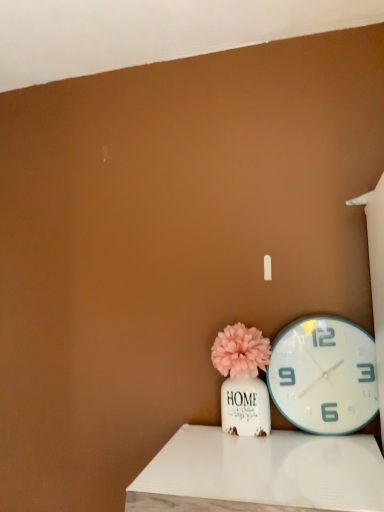
Question: Is white plastic wall clock at right with white wood table at lower center?

Choices:
 (A) yes
 (B) no

Answer: (B)

Question: Can you confirm if white plastic wall clock at right is positioned to the right of white wood table at lower center?

Choices:
 (A) no
 (B) yes

Answer: (B)

Question: Can you confirm if white plastic wall clock at right is thinner than white wood table at lower center?

Choices:
 (A) no
 (B) yes

Answer: (B)

Question: Does white plastic wall clock at right have a smaller size compared to white wood table at lower center?

Choices:
 (A) yes
 (B) no

Answer: (A)

Question: Is white plastic wall clock at right completely or partially outside of white wood table at lower center?

Choices:
 (A) yes
 (B) no

Answer: (A)

Question: Can you confirm if white plastic wall clock at right is bigger than white wood table at lower center?

Choices:
 (A) yes
 (B) no

Answer: (B)

Question: From a real-world perspective, is white wood table at lower center on top of matte pink pom-pom at center?

Choices:
 (A) yes
 (B) no

Answer: (B)

Question: Does white wood table at lower center have a lesser width compared to matte pink pom-pom at center?

Choices:
 (A) no
 (B) yes

Answer: (A)

Question: From the image's perspective, is white wood table at lower center located beneath matte pink pom-pom at center?

Choices:
 (A) yes
 (B) no

Answer: (A)

Question: Does white wood table at lower center have a greater width compared to matte pink pom-pom at center?

Choices:
 (A) no
 (B) yes

Answer: (B)

Question: Considering the relative sizes of white wood table at lower center and matte pink pom-pom at center in the image provided, is white wood table at lower center bigger than matte pink pom-pom at center?

Choices:
 (A) yes
 (B) no

Answer: (A)

Question: Is white wood table at lower center positioned in front of matte pink pom-pom at center?

Choices:
 (A) yes
 (B) no

Answer: (A)

Question: Are white wood table at lower center and white plastic wall clock at right making contact?

Choices:
 (A) yes
 (B) no

Answer: (B)